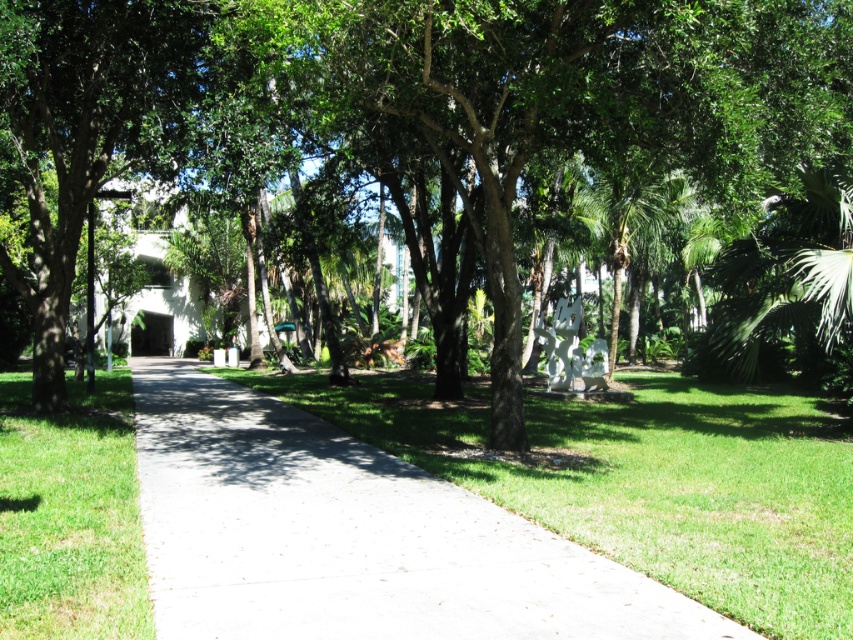
Question: Is green leafy tree at center behind green grass at lower left?

Choices:
 (A) no
 (B) yes

Answer: (B)

Question: Is white concrete pavement at center below green grass at lower left?

Choices:
 (A) no
 (B) yes

Answer: (B)

Question: Which of the following is the closest to the observer?

Choices:
 (A) (122, 547)
 (B) (468, 92)

Answer: (A)

Question: Estimate the real-world distances between objects in this image. Which object is farther from the green leafy tree at center?

Choices:
 (A) green grass at lower left
 (B) white concrete pavement at center

Answer: (A)

Question: Is green leafy tree at center positioned before green grass at lower left?

Choices:
 (A) no
 (B) yes

Answer: (A)

Question: Which point is closer to the camera taking this photo?

Choices:
 (A) (148, 131)
 (B) (61, 472)
 (C) (718, 628)

Answer: (C)